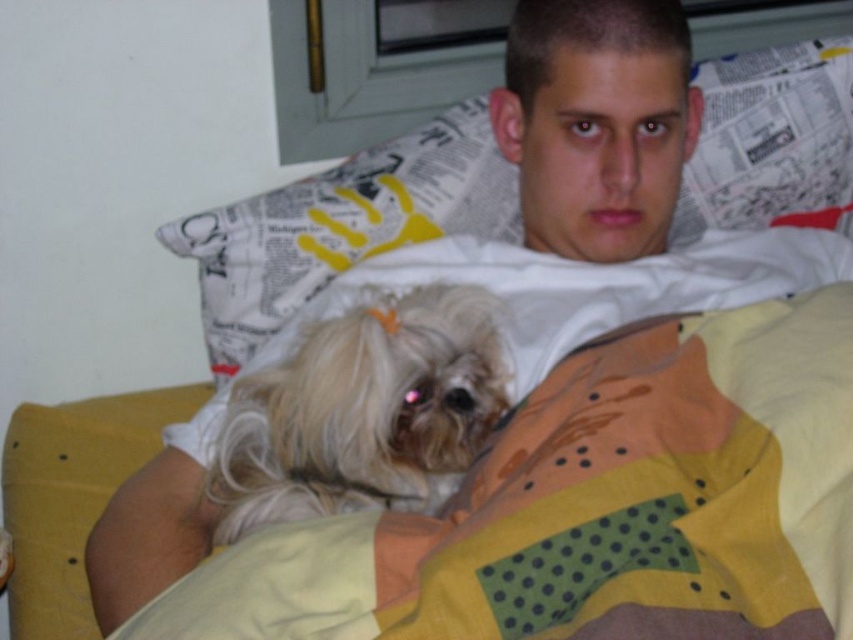
You are a photographer trying to capture the scene. You notice the yellow dotted fabric at lower center and the white newspaper at upper center. Which object is located to the right of the other?

The yellow dotted fabric at lower center is positioned on the right side of white newspaper at upper center.

You are standing in a room and want to reach a specific point in the room. The coordinates of the point are point (843, 99). If you can move forward 1.2 meters, will you be able to reach that point?

The distance between point (843, 99) and the viewer is 1.29 meters. Since you can move forward 1.2 meters, you will not be able to reach the point as you need to cover an additional 0.09 meters.

You are a photographer setting up a shot of the scene described. You want to ensure the yellow dotted fabric at lower center is in focus. Given that your camera has a depth of field that can sharply capture objects within 20 inches, will the fabric be in focus?

The yellow dotted fabric at lower center is 23.84 inches away from the camera, which is beyond the 20 inches depth of field range. Therefore, the fabric will not be in focus.